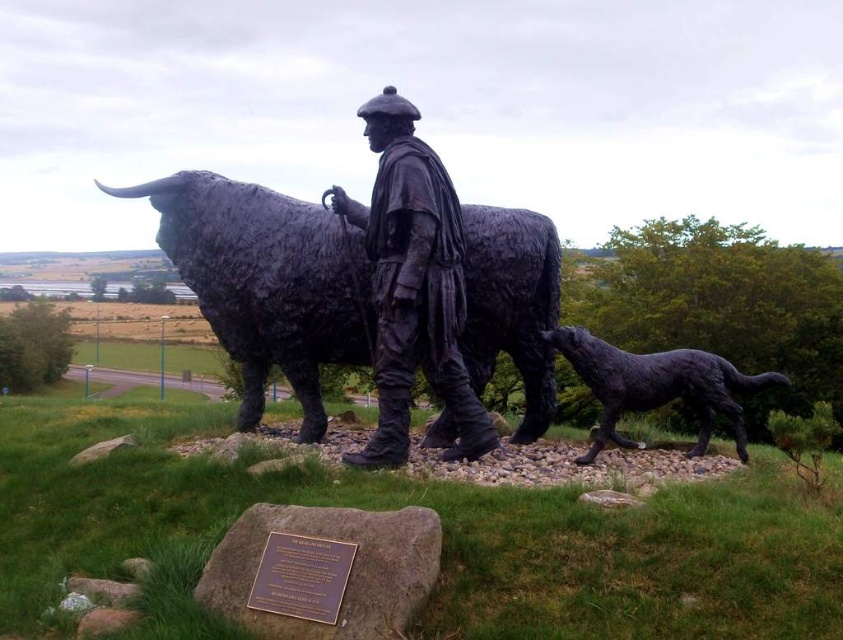
Is black polished stone bull at center bigger than bronze statue of man at center?

Yes, black polished stone bull at center is bigger than bronze statue of man at center.

Find the location of a particular element. black polished stone bull at center is located at coordinates (266, 282).

Who is positioned more to the right, bronze statue of man at center or shiny black dog at lower right?

From the viewer's perspective, shiny black dog at lower right appears more on the right side.

Is point (395, 141) behind point (663, 404)?

No, it is not.

The width and height of the screenshot is (843, 640). What are the coordinates of `bronze statue of man at center` in the screenshot? It's located at (412, 284).

Does black polished stone bull at center have a larger size compared to shiny black dog at lower right?

Yes.

Does black polished stone bull at center have a greater width compared to shiny black dog at lower right?

Yes, black polished stone bull at center is wider than shiny black dog at lower right.

Between point (275, 273) and point (626, 448), which one is positioned behind?

Point (626, 448)

Image resolution: width=843 pixels, height=640 pixels. Identify the location of black polished stone bull at center. (266, 282).